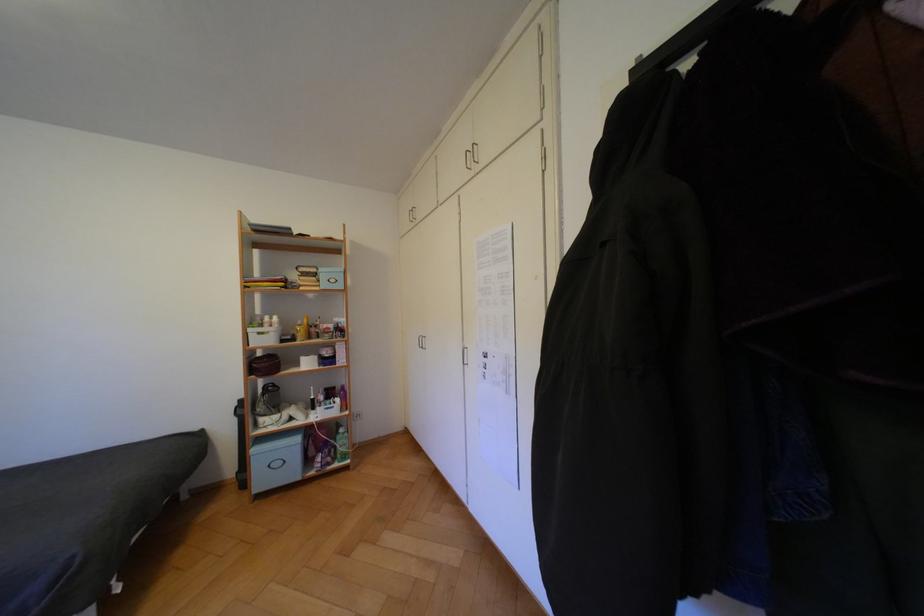
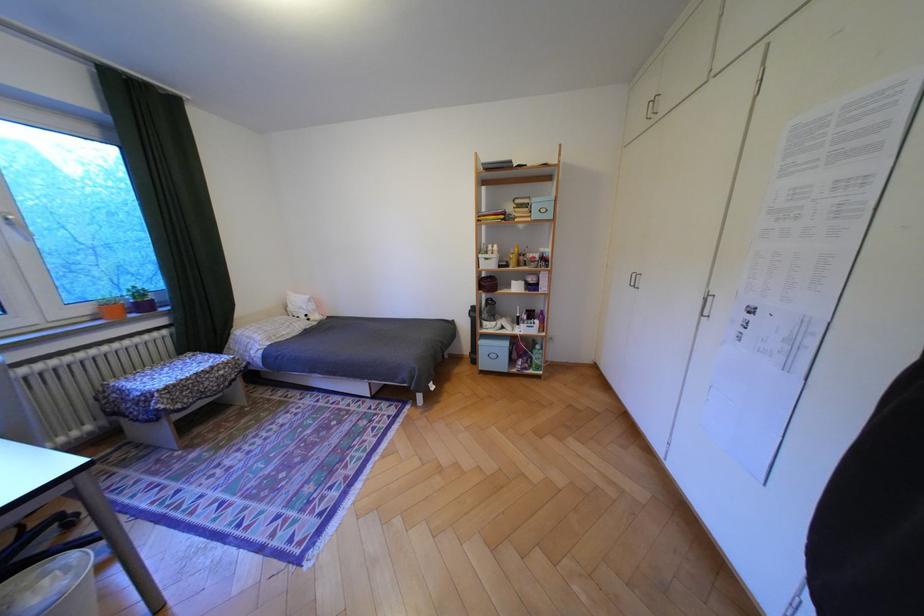
The point at (341,464) is marked in the first image. Where is the corresponding point in the second image?

(538, 369)